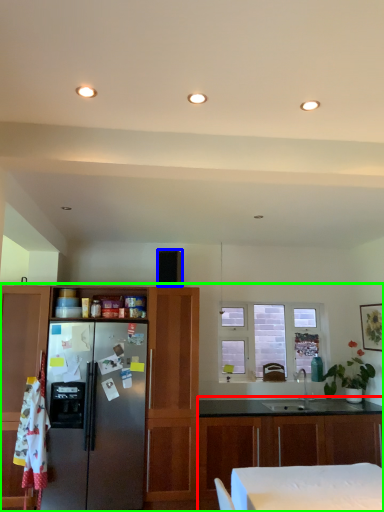
Question: Considering the real-world distances, which object is closest to cabinetry (highlighted by a red box)? appliance (highlighted by a blue box) or cabinetry (highlighted by a green box).

Choices:
 (A) appliance
 (B) cabinetry

Answer: (B)